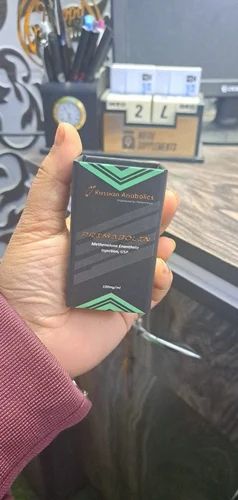
Identify the location of clock. (69, 113).